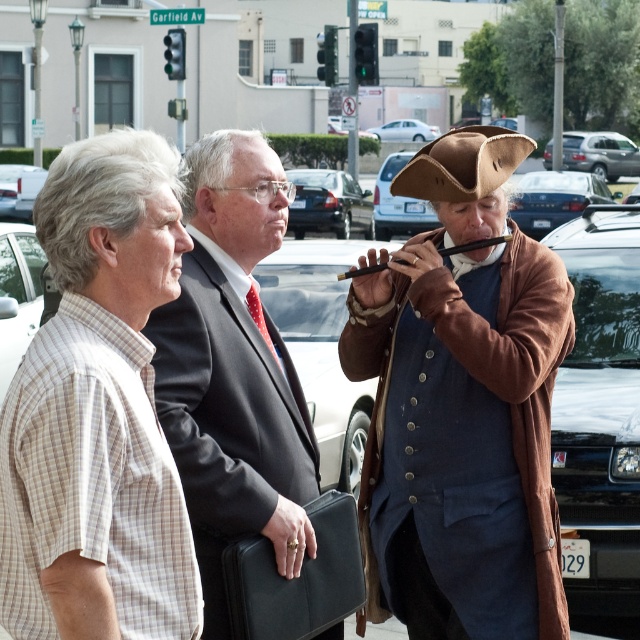
Question: Which point is farther to the camera?

Choices:
 (A) white matte van at left
 (B) plaid cotton shirt at left
 (C) matte black suit at center
 (D) black glossy car at right

Answer: (A)

Question: Which point appears farthest from the camera in this image?

Choices:
 (A) (435, 413)
 (B) (10, 189)
 (C) (202, 243)
 (D) (388, 138)

Answer: (D)

Question: Considering the real-world distances, which object is farthest from the silver metallic sedan at center?

Choices:
 (A) satin silver suv at upper right
 (B) black glossy car at right
 (C) metallic silver car at center
 (D) matte black sedan at center

Answer: (A)

Question: Can you confirm if matte black suit at center is positioned below wooden flute at center?

Choices:
 (A) no
 (B) yes

Answer: (B)

Question: Observing the image, what is the correct spatial positioning of brown leather coat at center in reference to black leather briefcase at center?

Choices:
 (A) below
 (B) above

Answer: (B)

Question: Is black leather briefcase at center above wooden flute at center?

Choices:
 (A) no
 (B) yes

Answer: (A)